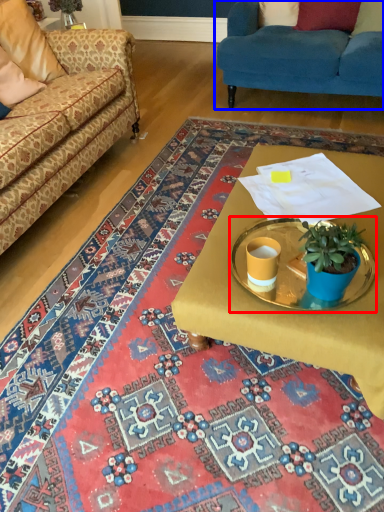
Question: Among these objects, which one is farthest to the camera, round table (highlighted by a red box) or studio couch (highlighted by a blue box)?

Choices:
 (A) round table
 (B) studio couch

Answer: (B)